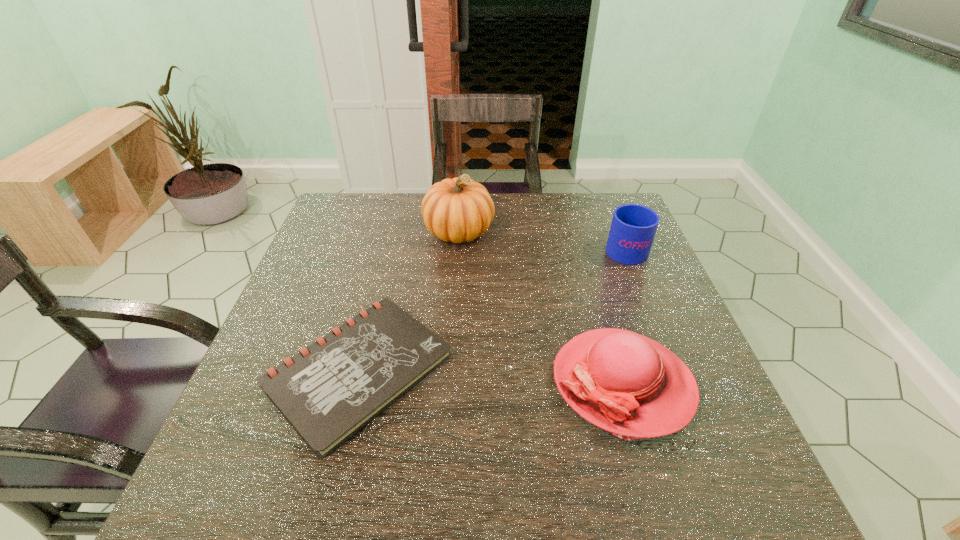
The width and height of the screenshot is (960, 540). I want to click on free point at the left edge, so click(x=312, y=244).

In the image, there is a desktop. At what (x,y) coordinates should I click in order to perform the action: click on vacant space at the right edge. Please return your answer as a coordinate pair (x, y). The height and width of the screenshot is (540, 960). Looking at the image, I should click on (601, 275).

Locate an element on the screen. This screenshot has width=960, height=540. vacant space at the far left corner of the desktop is located at coordinates (334, 208).

Find the location of `free location at the near left corner`. free location at the near left corner is located at coordinates (252, 495).

Locate an element on the screen. vacant space at the far right corner of the desktop is located at coordinates (584, 199).

This screenshot has width=960, height=540. In order to click on unoccupied area between the pumpkin and the mug in this screenshot , I will do `click(541, 239)`.

Where is `free space between the hat and the mug`? free space between the hat and the mug is located at coordinates (624, 315).

I want to click on unoccupied position between the pumpkin and the notebook, so click(409, 300).

Locate an element on the screen. Image resolution: width=960 pixels, height=540 pixels. vacant space that is in between the shortest object and the hat is located at coordinates (491, 376).

This screenshot has height=540, width=960. Find the location of `free space between the tallest object and the hat`. free space between the tallest object and the hat is located at coordinates (540, 307).